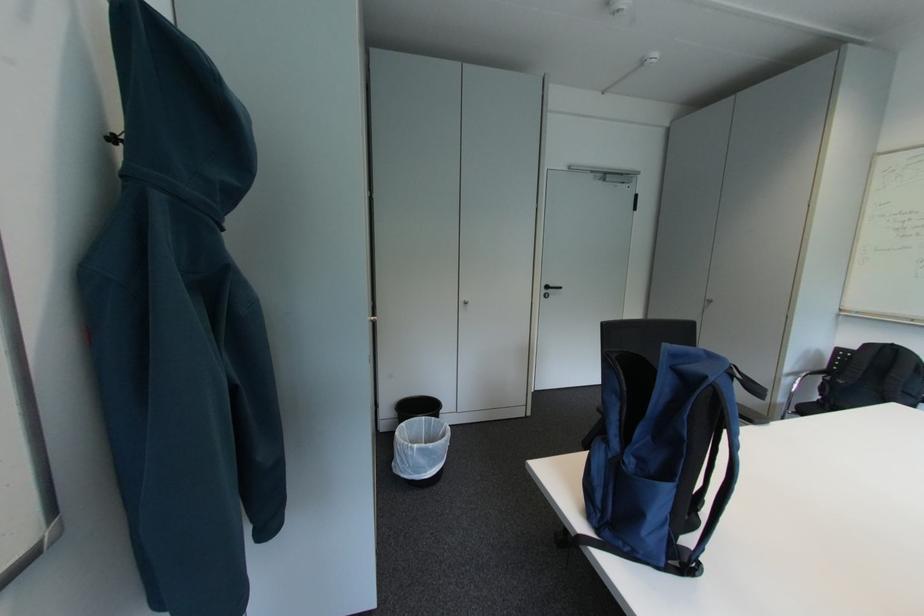
The width and height of the screenshot is (924, 616). What do you see at coordinates (799, 387) in the screenshot?
I see `a chair armrest` at bounding box center [799, 387].